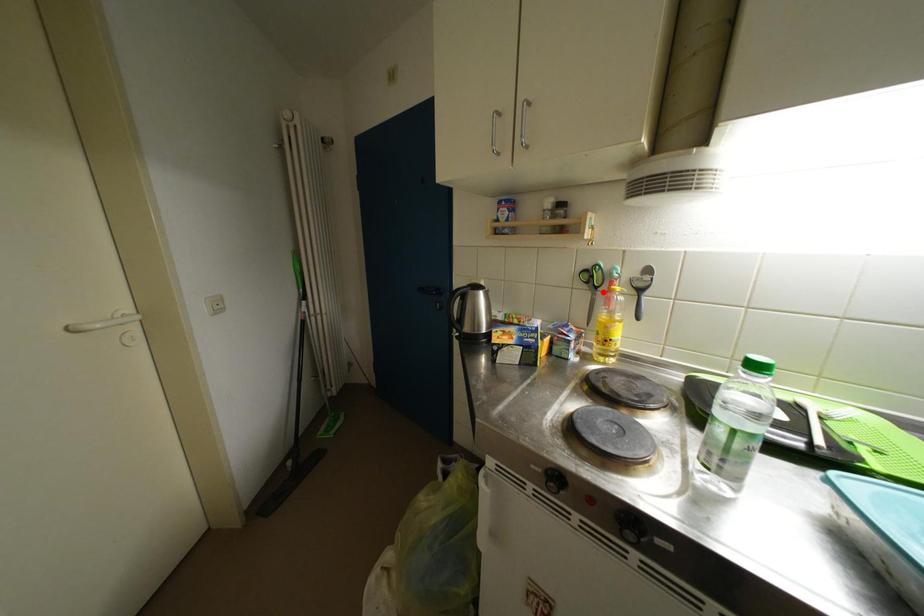
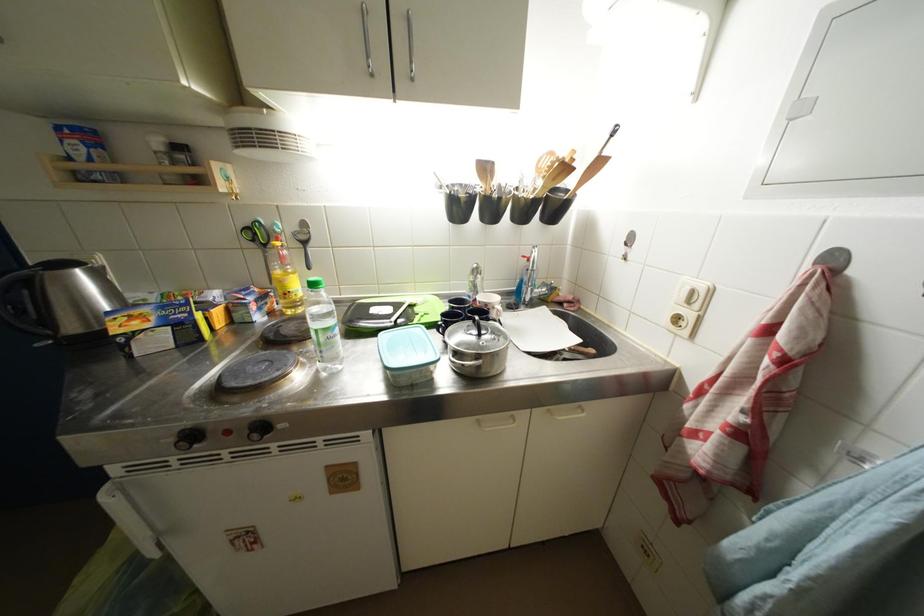
Find the pixel in the second image that matches the highlighted location in the first image.

(272, 249)